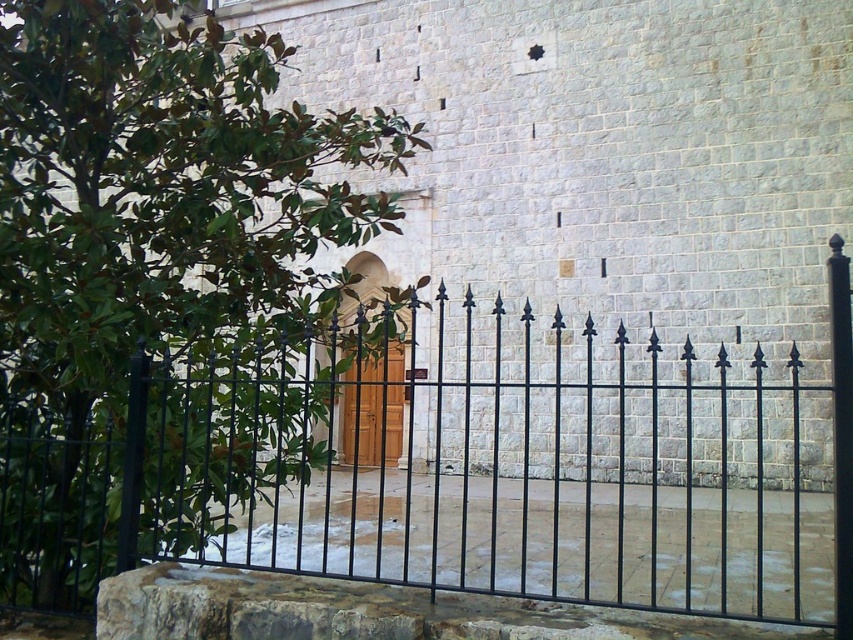
Can you confirm if green leafy tree at left is taller than wooden door at center?

Yes, green leafy tree at left is taller than wooden door at center.

Who is more forward, (x=74, y=332) or (x=381, y=376)?

Point (x=74, y=332) is in front.

Is point (103, 257) behind point (355, 392)?

That is False.

Find the location of a particular element. This screenshot has height=640, width=853. green leafy tree at left is located at coordinates (165, 284).

Does black wrought iron fence at center come in front of wooden door at center?

Yes, black wrought iron fence at center is in front of wooden door at center.

Image resolution: width=853 pixels, height=640 pixels. What do you see at coordinates (447, 476) in the screenshot? I see `black wrought iron fence at center` at bounding box center [447, 476].

I want to click on black wrought iron fence at center, so click(447, 476).

Can you confirm if black wrought iron fence at center is smaller than green leafy tree at left?

Indeed, black wrought iron fence at center has a smaller size compared to green leafy tree at left.

Does black wrought iron fence at center appear over green leafy tree at left?

No, black wrought iron fence at center is not above green leafy tree at left.

Which is in front, point (787, 458) or point (242, 253)?

Point (242, 253) is in front.

Locate an element on the screen. black wrought iron fence at center is located at coordinates (447, 476).